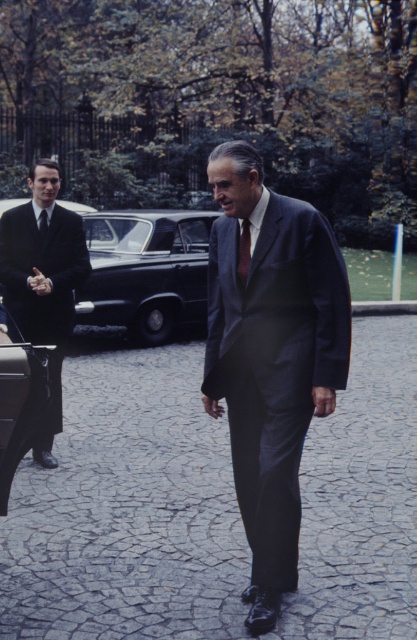
Question: Observing the image, what is the correct spatial positioning of dark blue suit at center in reference to shiny black suit at left?

Choices:
 (A) below
 (B) above

Answer: (A)

Question: Is dark blue suit at center above shiny black suit at left?

Choices:
 (A) yes
 (B) no

Answer: (B)

Question: Which object appears closest to the camera in this image?

Choices:
 (A) dark brown textured tie at center
 (B) black leather car at left
 (C) dark blue suit at center
 (D) black silk tie at left

Answer: (B)

Question: Can you confirm if black leather car at left is positioned to the right of dark brown textured tie at center?

Choices:
 (A) no
 (B) yes

Answer: (A)

Question: Which object is the closest to the black leather car at left?

Choices:
 (A) black silk tie at left
 (B) dark brown textured tie at center
 (C) shiny black car at center
 (D) dark blue suit at center

Answer: (B)

Question: Which of the following is the closest to the observer?

Choices:
 (A) black silk tie at left
 (B) shiny black suit at left
 (C) dark brown textured tie at center
 (D) black leather car at left

Answer: (D)